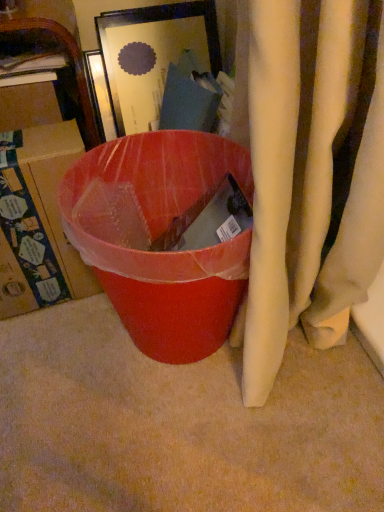
Question: From the image's perspective, is matte plastic trash can at center positioned above or below matte cardboard box at left?

Choices:
 (A) below
 (B) above

Answer: (A)

Question: From a real-world perspective, relative to matte cardboard box at left, is matte plastic trash can at center vertically above or below?

Choices:
 (A) below
 (B) above

Answer: (A)

Question: Is matte plastic trash can at center wider or thinner than matte cardboard box at left?

Choices:
 (A) thin
 (B) wide

Answer: (B)

Question: Considering the positions of matte cardboard box at left and matte plastic trash can at center in the image, is matte cardboard box at left wider or thinner than matte plastic trash can at center?

Choices:
 (A) thin
 (B) wide

Answer: (A)

Question: From a real-world perspective, relative to matte plastic trash can at center, is matte cardboard box at left vertically above or below?

Choices:
 (A) below
 (B) above

Answer: (B)

Question: Is point tap(0, 194) closer or farther from the camera than point tap(117, 229)?

Choices:
 (A) farther
 (B) closer

Answer: (B)

Question: Based on their sizes in the image, would you say matte cardboard box at left is bigger or smaller than matte plastic trash can at center?

Choices:
 (A) small
 (B) big

Answer: (A)